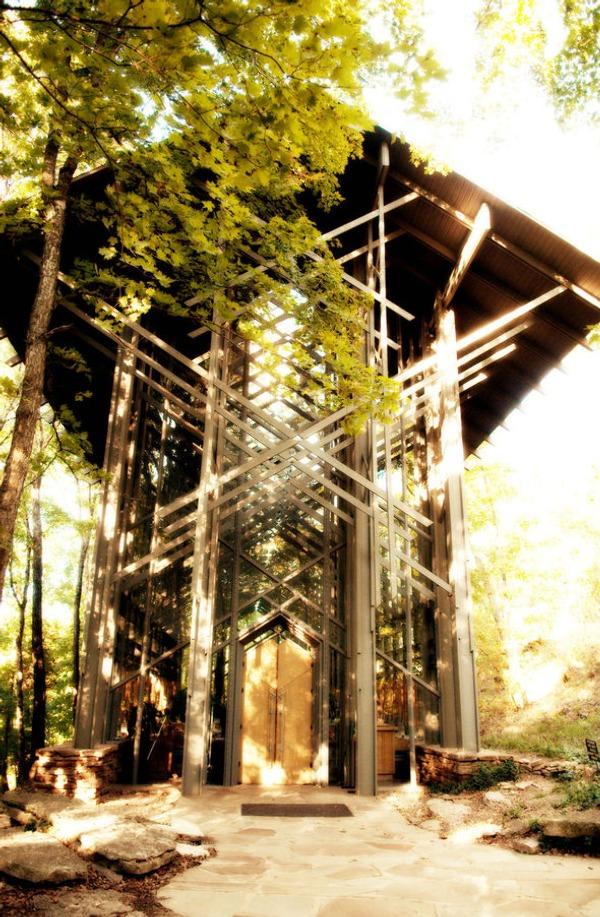
Find the location of `door`. door is located at coordinates click(305, 750).